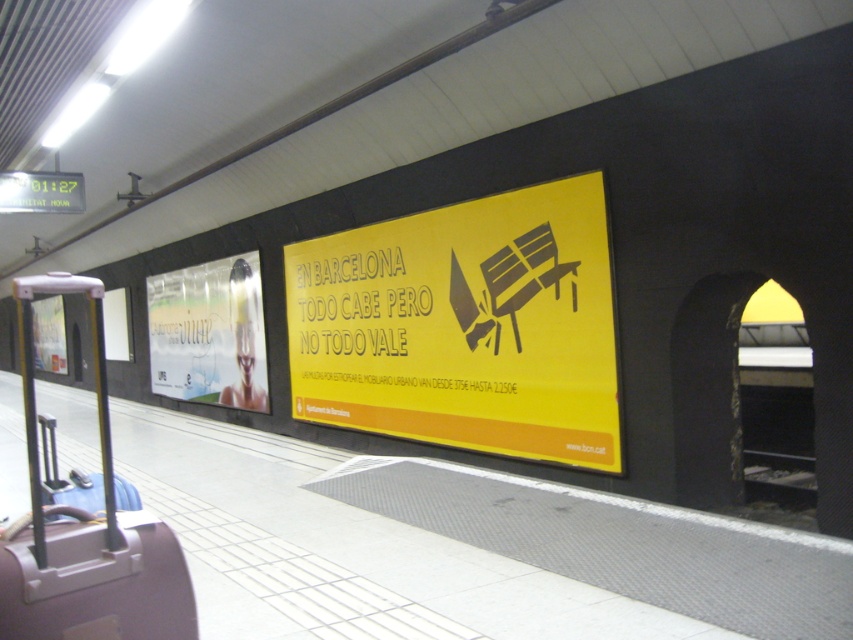
Question: Can you confirm if purple matte suitcase at left is thinner than yellow matte sign at center?

Choices:
 (A) no
 (B) yes

Answer: (A)

Question: Does metallic glossy poster at left have a greater width compared to blue fabric suitcase at lower left?

Choices:
 (A) no
 (B) yes

Answer: (A)

Question: Among these objects, which one is farthest from the camera?

Choices:
 (A) yellow paper sign at center
 (B) yellow matte sign at center

Answer: (B)

Question: Estimate the real-world distances between objects in this image. Which object is closer to the yellow matte sign at center?

Choices:
 (A) yellow paper sign at center
 (B) blue fabric suitcase at lower left
 (C) metallic glossy poster at left
 (D) purple matte suitcase at left

Answer: (A)

Question: Considering the relative positions of yellow matte sign at center and blue fabric suitcase at lower left in the image provided, where is yellow matte sign at center located with respect to blue fabric suitcase at lower left?

Choices:
 (A) above
 (B) below

Answer: (A)

Question: Which point is farther from the camera taking this photo?

Choices:
 (A) (16, 572)
 (B) (372, 268)
 (C) (207, 401)
 (D) (560, 378)

Answer: (C)